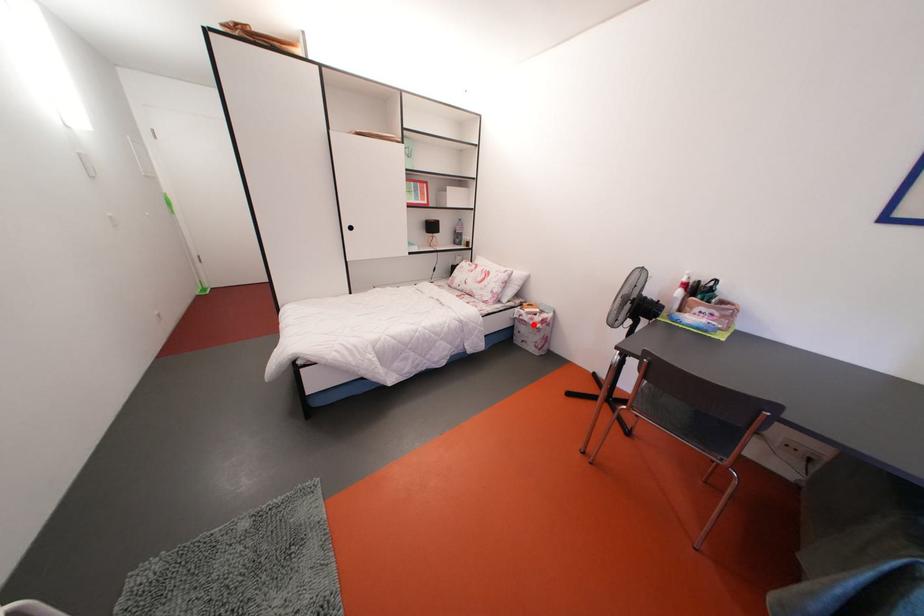
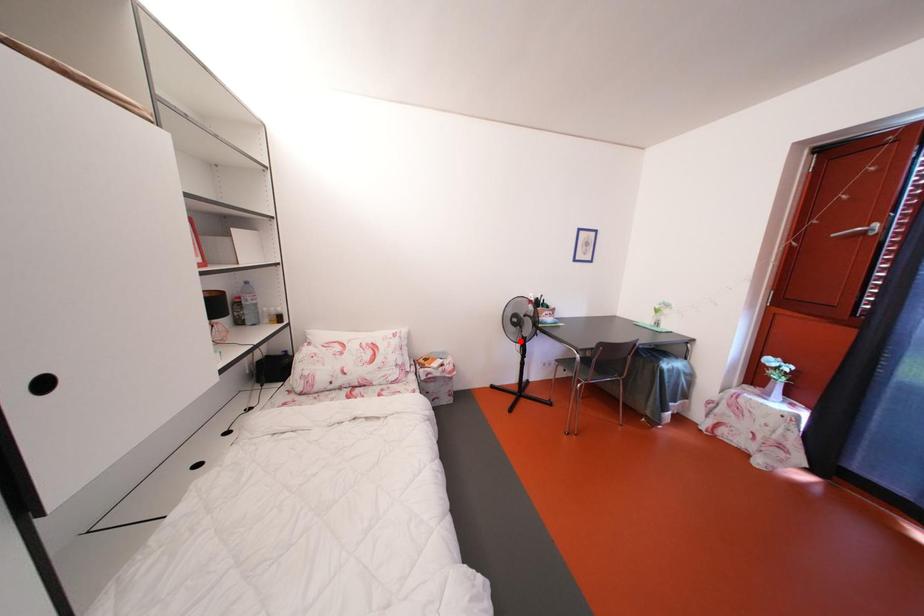
I am providing you with two images of the same scene from different viewpoints. A red point is marked on the first image and another point is marked on the second image. Is the marked point in image1 the same physical position as the marked point in image2?

No